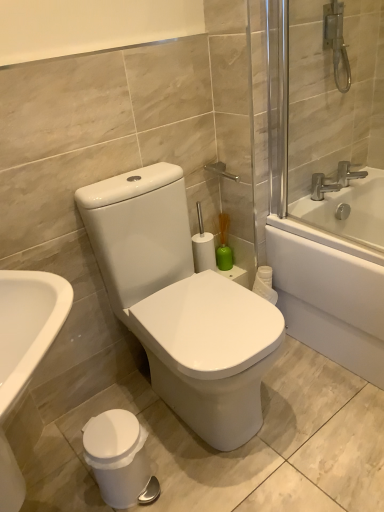
Question: Relative to silver metallic faucet at upper right, the first tap from the right, is white glossy bathtub at upper right in front or behind?

Choices:
 (A) front
 (B) behind

Answer: (A)

Question: Based on their sizes in the image, would you say white glossy bathtub at upper right is bigger or smaller than silver metallic faucet at upper right, the first tap from the right?

Choices:
 (A) big
 (B) small

Answer: (A)

Question: Which object is the farthest from the white plastic trash can at lower left?

Choices:
 (A) white glossy bathtub at upper right
 (B) silver metallic faucet at upper right, the first tap from the right
 (C) silver metallic faucet at upper right, marked as the 2th tap in a right-to-left arrangement
 (D) white glossy toilet at center

Answer: (B)

Question: Estimate the real-world distances between objects in this image. Which object is farther from the white glossy bathtub at upper right?

Choices:
 (A) silver metallic faucet at upper right, marked as the 2th tap in a right-to-left arrangement
 (B) silver metallic faucet at upper right, which is the 2th tap from left to right
 (C) white glossy toilet at center
 (D) white plastic trash can at lower left

Answer: (D)